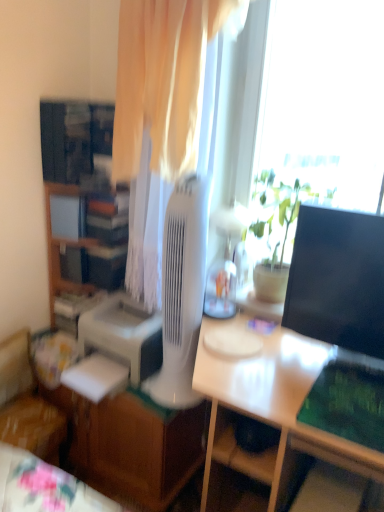
Locate an element on the screen. vacant area on top of white glossy desk at center, which ranks as the 1th desk in right-to-left order (from a real-world perspective) is located at coordinates (265, 357).